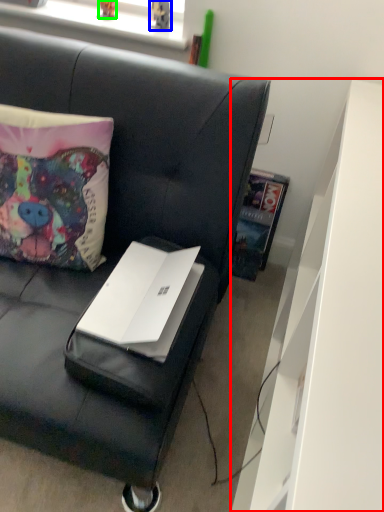
Question: Based on their relative distances, which object is farther from dresser (highlighted by a red box)? Choose from toy (highlighted by a blue box) and toy (highlighted by a green box).

Choices:
 (A) toy
 (B) toy

Answer: (B)